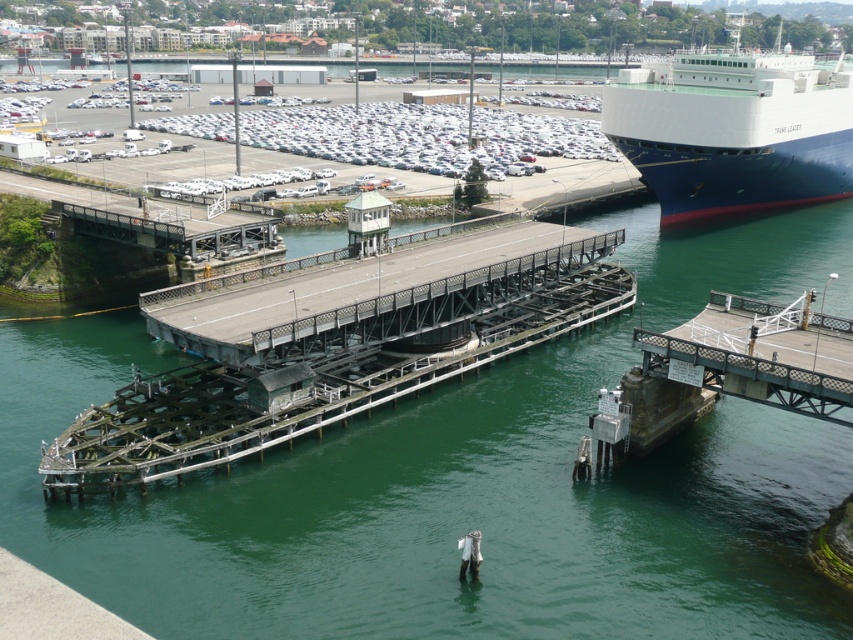
You are a crane operator on the blue polished steel ship at right, and you need to lower a heavy container onto the deck of the greenish metallic bridge at center. Can you safely perform this task while the bridge is in its current raised position?

The greenish metallic bridge at center is positioned on the left side of the blue polished steel ship at right, so the bridge is raised to allow the ship to pass. Lowering a container onto the bridge deck while it is raised would be unsafe as the deck is not level and stable. You should wait until the bridge lowers back to its horizontal position before attempting this task.

You are a crane operator on the blue polished steel ship at right and need to lower a heavy container. The greenish metallic bridge at center is in your way. Can you safely lower the container without hitting the bridge?

The greenish metallic bridge at center has a lesser width compared to blue polished steel ship at right, so the container can be lowered safely as long as it stays within the ship area, avoiding the narrower bridge.

You are a crane operator on the blue polished steel ship at right and need to lower a heavy container. The greenish metallic bridge at center is in your path. Can you safely lower the container without hitting the bridge?

The greenish metallic bridge at center is positioned under the blue polished steel ship at right, so lowering the container would risk collision with the bridge. You should adjust the crane arm to avoid the bridge or wait until the bridge lowers.